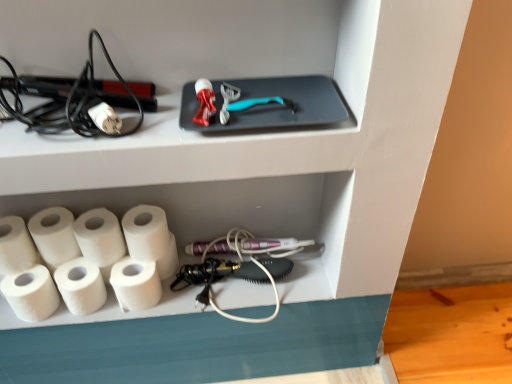
Question: Does black plastic hair straightener at left turn towards white matte paper towel at lower left, which ranks as the fifth paper towel in right-to-left order?

Choices:
 (A) no
 (B) yes

Answer: (A)

Question: Can you confirm if black plastic hair straightener at left is thinner than white matte paper towel at lower left, which ranks as the fifth paper towel in right-to-left order?

Choices:
 (A) yes
 (B) no

Answer: (B)

Question: Is black plastic hair straightener at left positioned far away from white matte paper towel at lower left, the 3th paper towel from the left?

Choices:
 (A) no
 (B) yes

Answer: (A)

Question: From the image's perspective, is black plastic hair straightener at left under white matte paper towel at lower left, the 3th paper towel from the left?

Choices:
 (A) no
 (B) yes

Answer: (A)

Question: Is black plastic hair straightener at left looking in the opposite direction of white matte paper towel at lower left, the 3th paper towel from the left?

Choices:
 (A) yes
 (B) no

Answer: (B)

Question: Based on their sizes in the image, would you say white matte paper towel at lower left, the 3th paper towel from the left, is bigger or smaller than white matte paper towel at lower left, positioned as the seventh paper towel in left-to-right order?

Choices:
 (A) big
 (B) small

Answer: (A)

Question: Would you say white matte paper towel at lower left, which ranks as the fifth paper towel in right-to-left order, is inside or outside white matte paper towel at lower left, positioned as the seventh paper towel in left-to-right order?

Choices:
 (A) outside
 (B) inside

Answer: (A)

Question: Looking at their shapes, would you say white matte paper towel at lower left, which ranks as the fifth paper towel in right-to-left order, is wider or thinner than white matte paper towel at lower left, positioned as the seventh paper towel in left-to-right order?

Choices:
 (A) thin
 (B) wide

Answer: (A)

Question: From a real-world perspective, is white matte paper towel at lower left, the 3th paper towel from the left, above or below white matte paper towel at lower left, the first paper towel when ordered from right to left?

Choices:
 (A) below
 (B) above

Answer: (A)

Question: Does point (40, 269) appear closer or farther from the camera than point (150, 96)?

Choices:
 (A) closer
 (B) farther

Answer: (B)

Question: Is white matte paper towel at lower left, arranged as the 6th paper towel when viewed from the right, situated inside black plastic hair straightener at left or outside?

Choices:
 (A) inside
 (B) outside

Answer: (B)

Question: Is white matte paper towel at lower left, acting as the 2th paper towel starting from the left, taller or shorter than black plastic hair straightener at left?

Choices:
 (A) tall
 (B) short

Answer: (B)

Question: Is white matte paper towel at lower left, arranged as the 6th paper towel when viewed from the right, in front of or behind black plastic hair straightener at left in the image?

Choices:
 (A) behind
 (B) front

Answer: (A)

Question: In terms of height, does black plastic hair straightener at left look taller or shorter compared to white matte paper towel at lower left, arranged as the fourth paper towel when viewed from the left?

Choices:
 (A) tall
 (B) short

Answer: (A)

Question: Looking at the image, does black plastic hair straightener at left seem bigger or smaller compared to white matte paper towel at lower left, marked as the fourth paper towel in a right-to-left arrangement?

Choices:
 (A) big
 (B) small

Answer: (A)